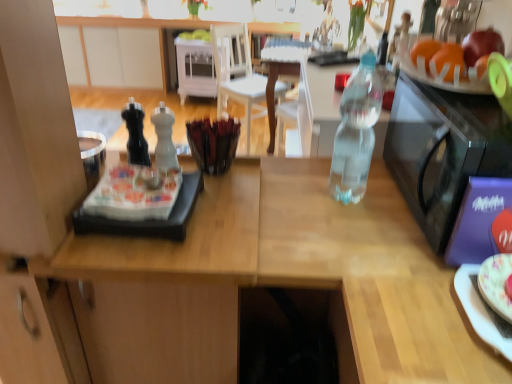
The image size is (512, 384). In order to click on empty space that is in between clear plastic bottle at center, which ranks as the 3th bottle in left-to-right order, and white matte pepper shaker at center, which is the second bottle in right-to-left order in this screenshot , I will do `click(272, 185)`.